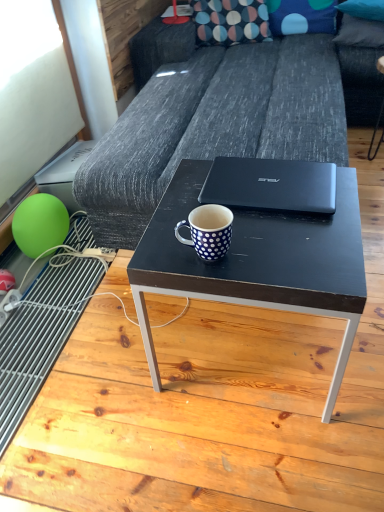
Question: From the image's perspective, does black matte laptop at center appear lower than polka dot fabric pillow at upper center, the 3th pillow from the right?

Choices:
 (A) yes
 (B) no

Answer: (A)

Question: Is black matte laptop at center at the left side of polka dot fabric pillow at upper center, the 3th pillow from the right?

Choices:
 (A) no
 (B) yes

Answer: (B)

Question: Considering the relative positions of black matte laptop at center and polka dot fabric pillow at upper center, positioned as the first pillow in left-to-right order, in the image provided, is black matte laptop at center to the right of polka dot fabric pillow at upper center, positioned as the first pillow in left-to-right order, from the viewer's perspective?

Choices:
 (A) yes
 (B) no

Answer: (B)

Question: Is polka dot fabric pillow at upper center, the 3th pillow from the right, at the back of black matte laptop at center?

Choices:
 (A) no
 (B) yes

Answer: (A)

Question: From a real-world perspective, is black matte laptop at center on top of polka dot fabric pillow at upper center, the 3th pillow from the right?

Choices:
 (A) yes
 (B) no

Answer: (B)

Question: Is black matte laptop at center outside of polka dot fabric pillow at upper center, the 3th pillow from the right?

Choices:
 (A) no
 (B) yes

Answer: (B)

Question: From the image's perspective, is blue dotted fabric pillow at upper right, the 1th pillow in the right-to-left sequence, over black matte table at center?

Choices:
 (A) yes
 (B) no

Answer: (A)

Question: Is black matte table at center a part of blue dotted fabric pillow at upper right, the 1th pillow in the right-to-left sequence?

Choices:
 (A) no
 (B) yes

Answer: (A)

Question: Is blue dotted fabric pillow at upper right, the third pillow positioned from the left, turned away from black matte table at center?

Choices:
 (A) no
 (B) yes

Answer: (A)

Question: Does blue dotted fabric pillow at upper right, the third pillow positioned from the left, come behind black matte table at center?

Choices:
 (A) no
 (B) yes

Answer: (B)

Question: Is blue dotted fabric pillow at upper right, the 1th pillow in the right-to-left sequence, oriented towards black matte table at center?

Choices:
 (A) no
 (B) yes

Answer: (A)

Question: Can you confirm if blue dotted fabric pillow at upper right, the 1th pillow in the right-to-left sequence, is wider than black matte table at center?

Choices:
 (A) yes
 (B) no

Answer: (B)

Question: Does black matte table at center come behind black matte laptop at center?

Choices:
 (A) yes
 (B) no

Answer: (B)